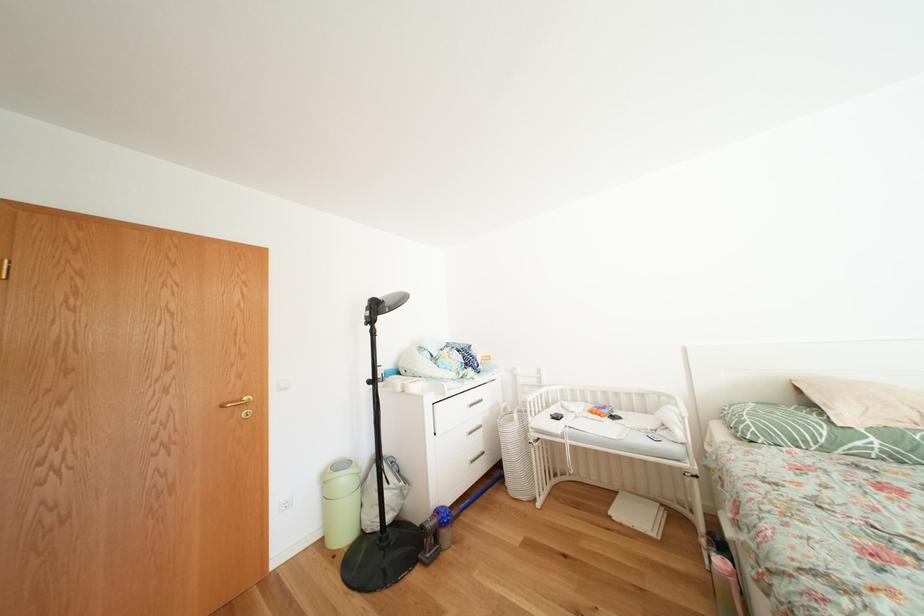
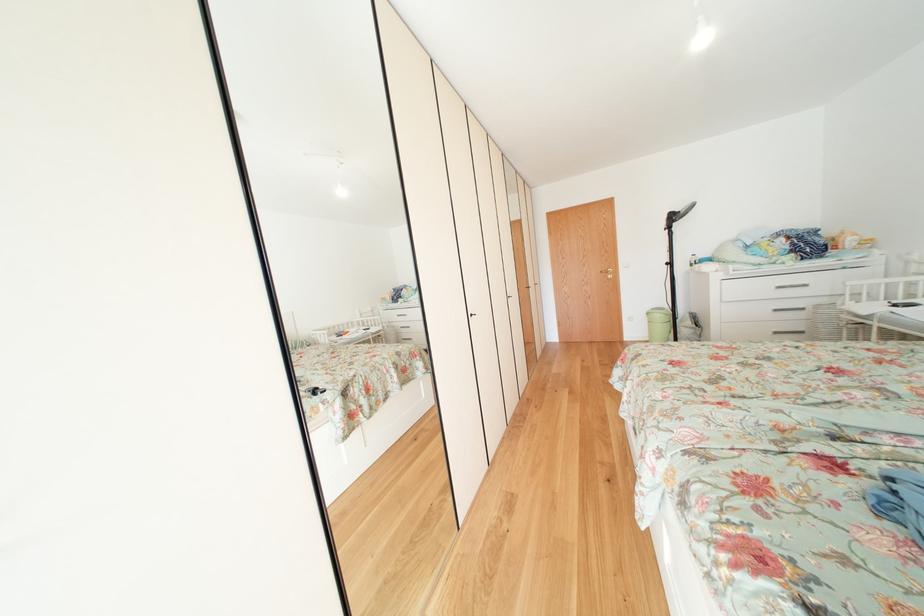
In the second image, find the point that corresponds to pixel 481 467 in the first image.

(784, 338)